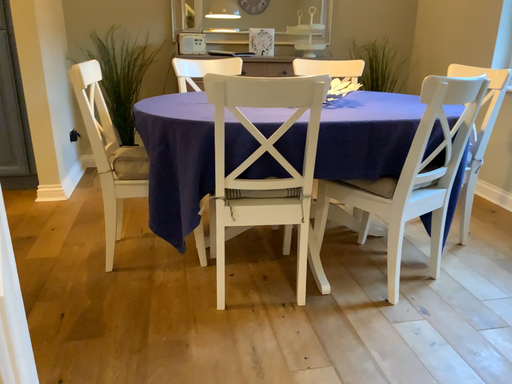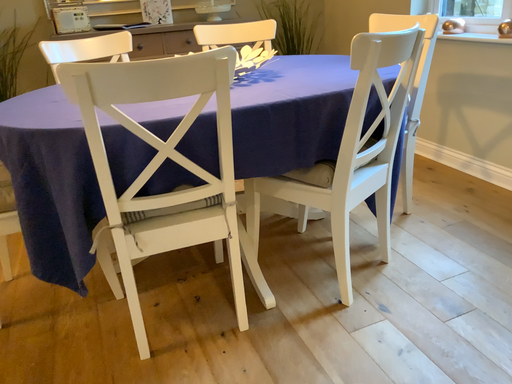
Question: Which way did the camera rotate in the video?

Choices:
 (A) rotated left
 (B) rotated right

Answer: (B)